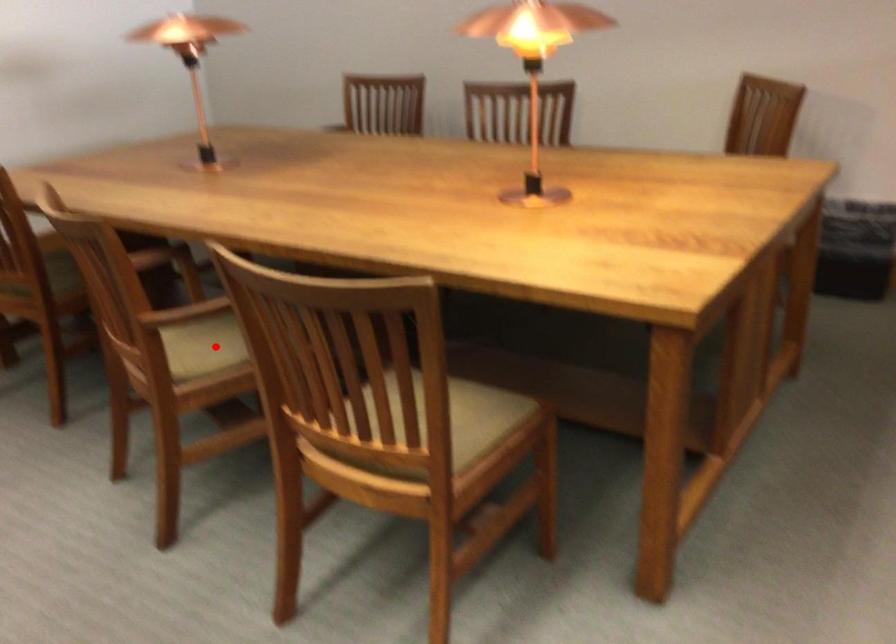
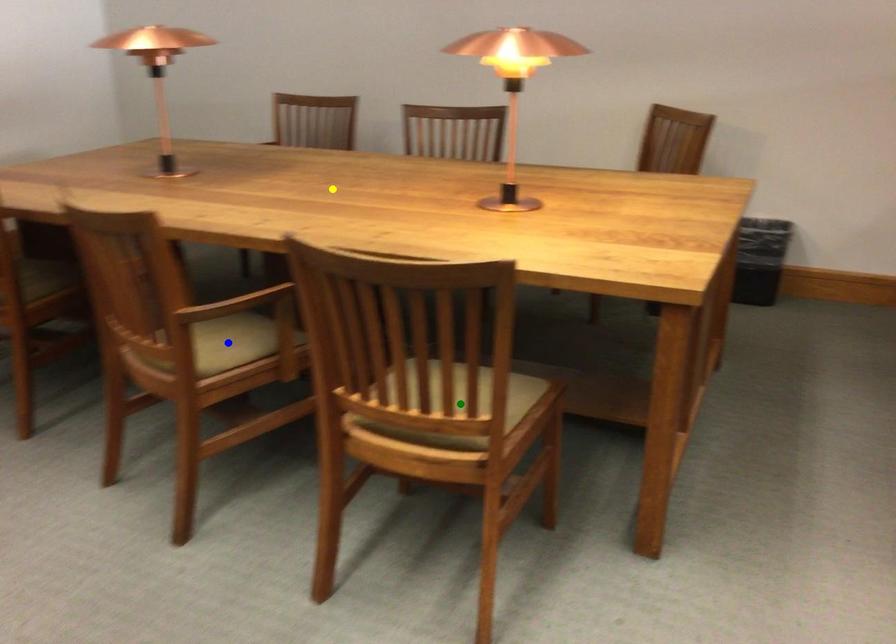
Question: I am providing you with two images of the same scene from different viewpoints. A red point is marked on the first image. You are given multiple points on the second image. Which point in image 2 is actually the same real-world point as the red point in image 1?

Choices:
 (A) blue point
 (B) green point
 (C) yellow point

Answer: (A)